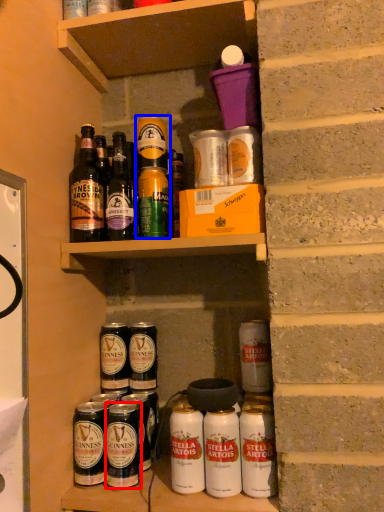
Question: Which object appears closest to the camera in this image, beverage (highlighted by a red box) or yoghurt (highlighted by a blue box)?

Choices:
 (A) beverage
 (B) yoghurt

Answer: (A)